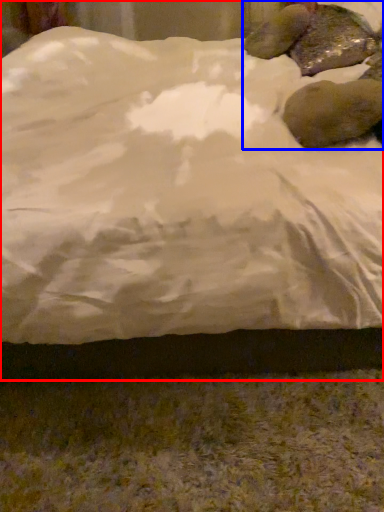
Question: Which object appears farthest to the camera in this image, bed (highlighted by a red box) or animal (highlighted by a blue box)?

Choices:
 (A) bed
 (B) animal

Answer: (B)